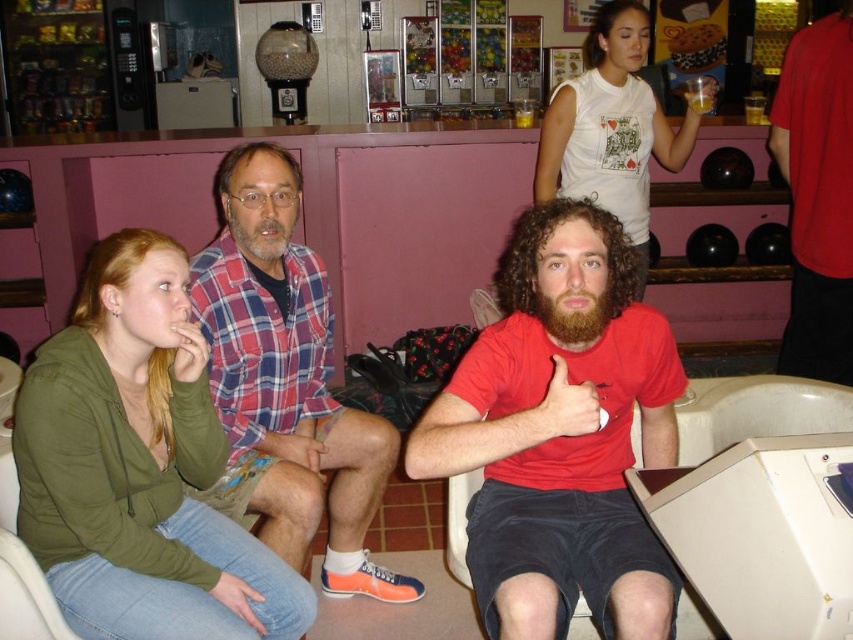
Based on the scene description, where is the plaid shirt at center located in the image?

The plaid shirt at center is located at point 0.600 on the x axis and 0.336 on the y axis.